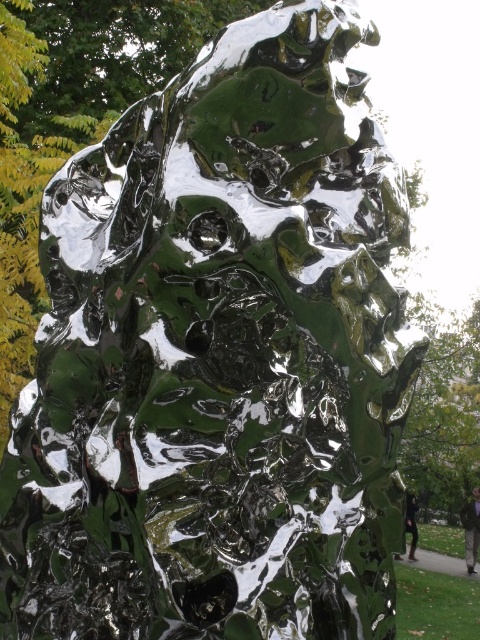
Question: Which point appears closest to the camera in this image?

Choices:
 (A) (410, 541)
 (B) (470, 524)

Answer: (A)

Question: Which of the following is the farthest from the observer?

Choices:
 (A) dark green glossy statue at right
 (B) glossy green sculpture at center

Answer: (B)

Question: Which of the following is the closest to the observer?

Choices:
 (A) glossy green sculpture at center
 (B) dark green glossy statue at right

Answer: (B)

Question: Is glossy green sculpture at center to the left of dark green glossy statue at right from the viewer's perspective?

Choices:
 (A) yes
 (B) no

Answer: (B)

Question: Does glossy green sculpture at center have a greater width compared to dark green glossy statue at right?

Choices:
 (A) no
 (B) yes

Answer: (B)

Question: Can you confirm if glossy green sculpture at center is wider than dark green glossy statue at right?

Choices:
 (A) yes
 (B) no

Answer: (A)